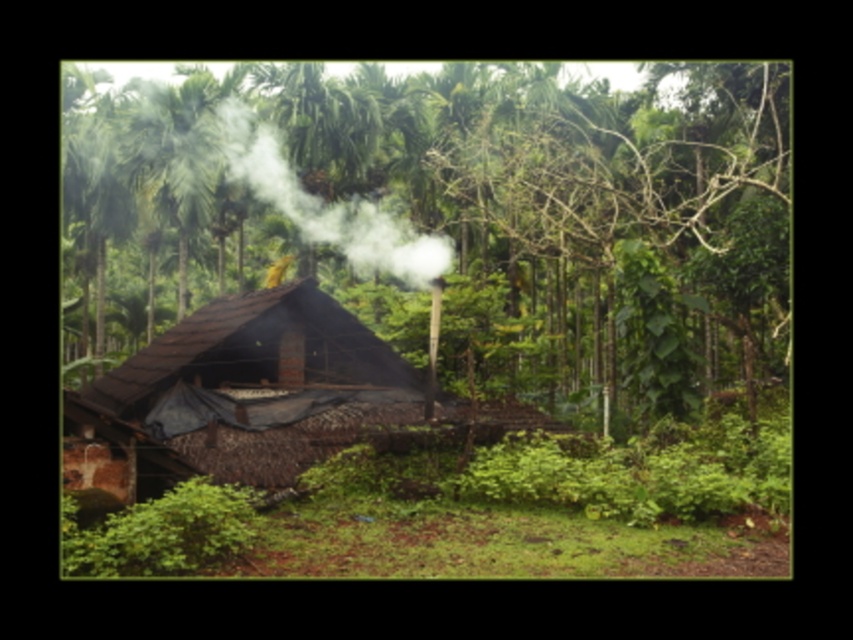
Based on the photo, you are standing at the point closest to the building. Which of the two points, point (392, 280) or point (267, 131), is farther away from you?

Point (392, 280) is farther away because it is behind point (267, 131), which is closer to you.

You are standing in front of the rustic building and want to take a photo. There are two points marked in the image, point 1 at coordinates point (x=152, y=432) and point 2 at coordinates point (x=421, y=252). Which point will appear larger in your camera view?

Point (x=152, y=432) is closer to the camera than point (x=421, y=252), so it will appear larger in the camera view.